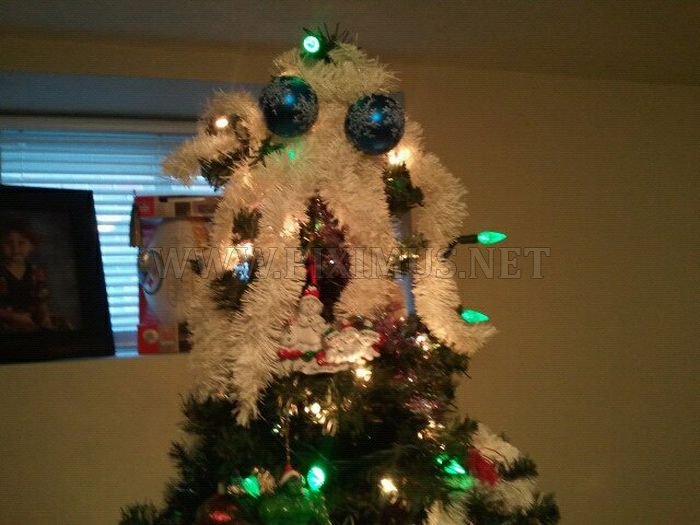
Image resolution: width=700 pixels, height=525 pixels. I want to click on white lights, so click(x=307, y=409), click(x=357, y=374), click(x=416, y=341), click(x=404, y=160), click(x=229, y=120).